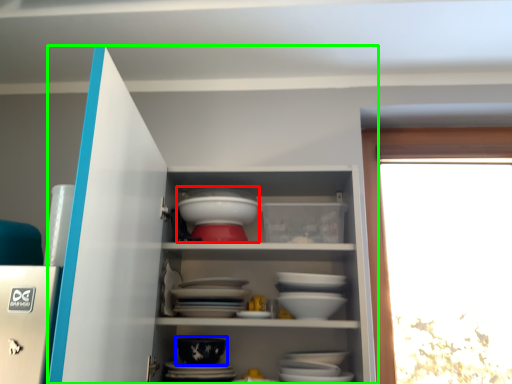
Question: Based on their relative distances, which object is farther from tableware (highlighted by a red box)? Choose from bowl (highlighted by a blue box) and cupboard (highlighted by a green box).

Choices:
 (A) bowl
 (B) cupboard

Answer: (A)